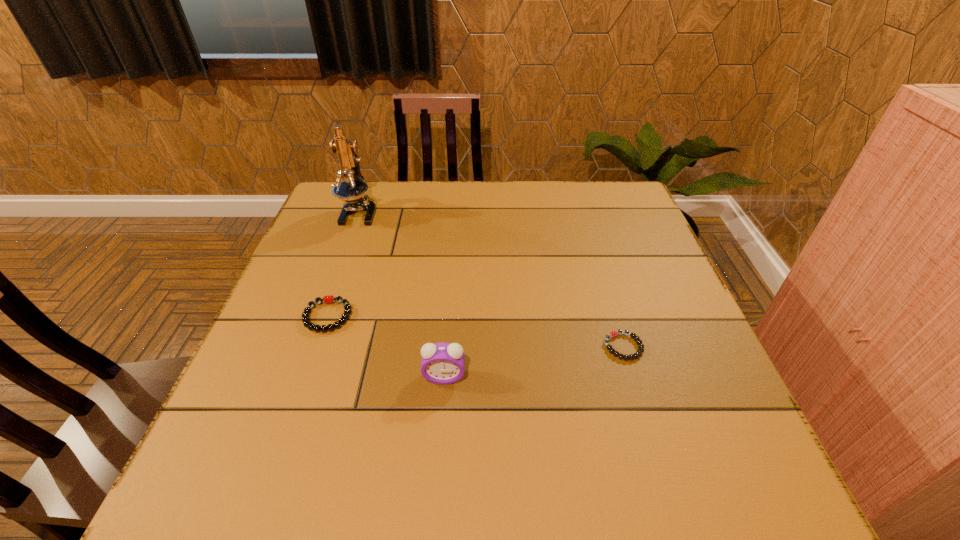
I want to click on the farthest object, so click(x=353, y=190).

Where is `the tallest object`? The image size is (960, 540). the tallest object is located at coordinates (353, 190).

The image size is (960, 540). Identify the location of alarm clock. (442, 363).

This screenshot has width=960, height=540. I want to click on the third shortest object, so click(442, 363).

Locate an element on the screen. the taller bracelet is located at coordinates (328, 299).

Identify the location of the left bracelet. (328, 299).

Identify the location of the right bracelet. (612, 334).

At what (x,y) coordinates should I click in order to perform the action: click on the shorter bracelet. Please return your answer as a coordinate pair (x, y). Looking at the image, I should click on (612, 334).

I want to click on free space located 0.180m at the eyepiece of the tallest object, so click(x=338, y=272).

The height and width of the screenshot is (540, 960). Find the location of `free space located on the face of the third shortest object`. free space located on the face of the third shortest object is located at coordinates (438, 464).